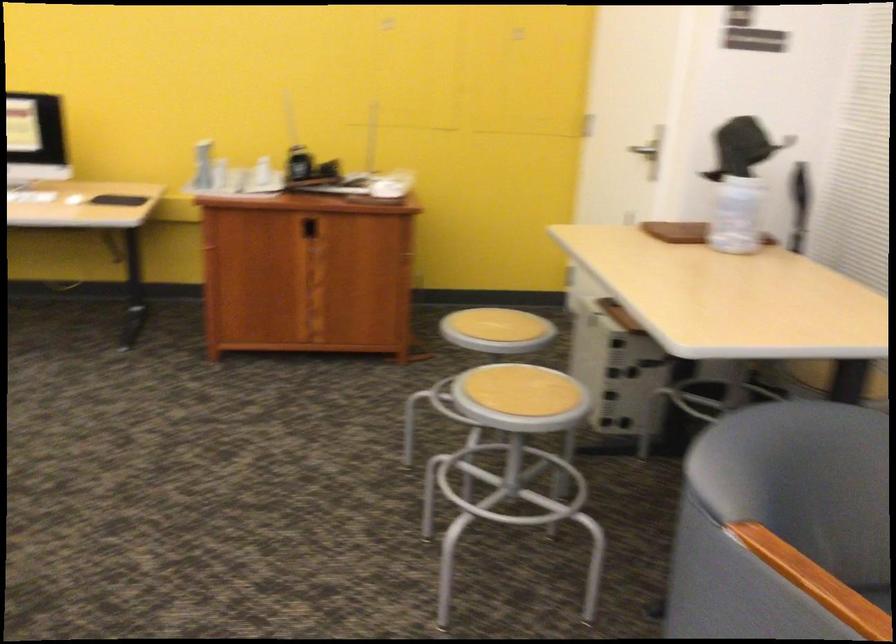
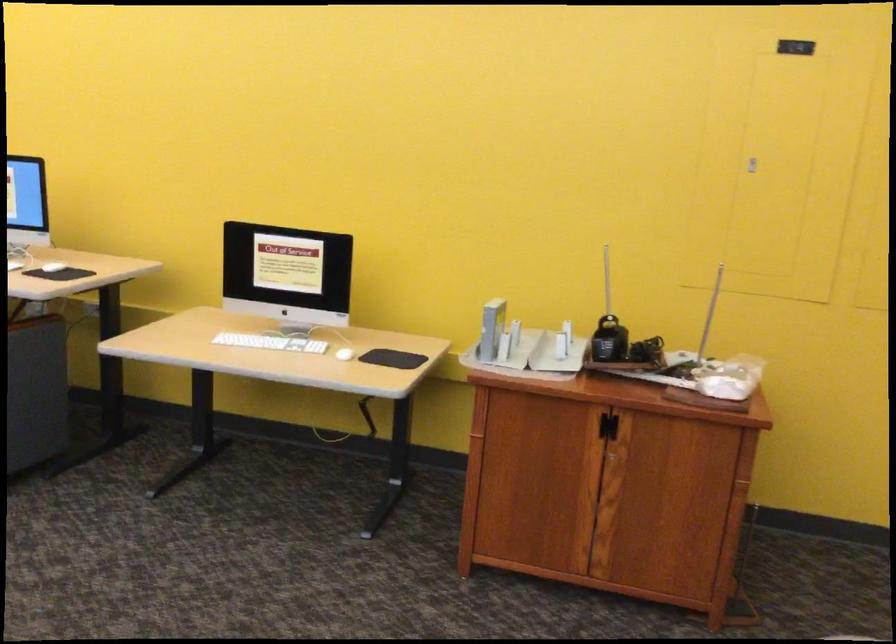
Question: The first image is from the beginning of the video and the second image is from the end. How did the camera likely rotate when shooting the video?

Choices:
 (A) Left
 (B) Right
 (C) Up
 (D) Down

Answer: (A)